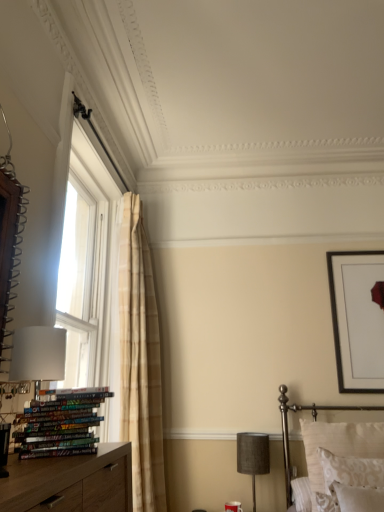
Question: Should I look upward or downward to see white matte table lamp at left, the 1th table lamp from the front?

Choices:
 (A) down
 (B) up

Answer: (A)

Question: From the image's perspective, is multicolored glossy books at lower left located above black matte picture frame at upper right?

Choices:
 (A) yes
 (B) no

Answer: (B)

Question: Is multicolored glossy books at lower left positioned far away from black matte picture frame at upper right?

Choices:
 (A) yes
 (B) no

Answer: (A)

Question: From the image's perspective, would you say multicolored glossy books at lower left is shown under black matte picture frame at upper right?

Choices:
 (A) yes
 (B) no

Answer: (A)

Question: Is multicolored glossy books at lower left positioned in front of black matte picture frame at upper right?

Choices:
 (A) yes
 (B) no

Answer: (A)

Question: From a real-world perspective, does multicolored glossy books at lower left sit lower than black matte picture frame at upper right?

Choices:
 (A) no
 (B) yes

Answer: (B)

Question: Considering the relative sizes of multicolored glossy books at lower left and black matte picture frame at upper right in the image provided, is multicolored glossy books at lower left wider than black matte picture frame at upper right?

Choices:
 (A) yes
 (B) no

Answer: (A)

Question: From the image's perspective, is white textured pillows at lower right beneath patterned fabric pillow at lower right?

Choices:
 (A) yes
 (B) no

Answer: (A)

Question: From the image's perspective, is white textured pillows at lower right on top of patterned fabric pillow at lower right?

Choices:
 (A) no
 (B) yes

Answer: (A)

Question: Could you tell me if white textured pillows at lower right is turned towards patterned fabric pillow at lower right?

Choices:
 (A) no
 (B) yes

Answer: (B)

Question: Is white textured pillows at lower right touching patterned fabric pillow at lower right?

Choices:
 (A) no
 (B) yes

Answer: (A)

Question: Considering the relative sizes of white textured pillows at lower right and patterned fabric pillow at lower right in the image provided, is white textured pillows at lower right taller than patterned fabric pillow at lower right?

Choices:
 (A) no
 (B) yes

Answer: (B)

Question: Is patterned fabric pillow at lower right at the back of white textured pillows at lower right?

Choices:
 (A) yes
 (B) no

Answer: (A)

Question: Does patterned fabric pillow at lower right have a greater height compared to white matte table lamp at left, the second table lamp viewed from the back?

Choices:
 (A) no
 (B) yes

Answer: (A)